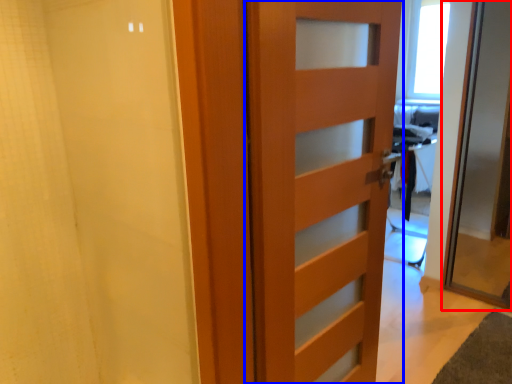
Question: Which object appears closest to the camera in this image, door (highlighted by a red box) or door (highlighted by a blue box)?

Choices:
 (A) door
 (B) door

Answer: (B)